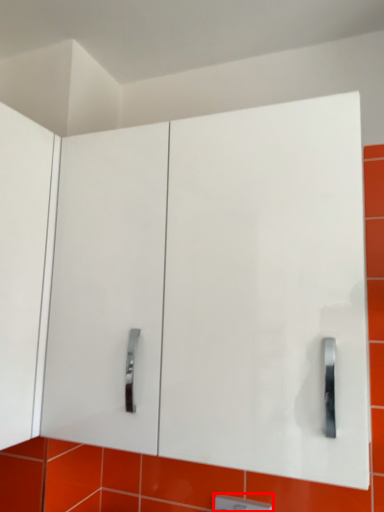
Question: From the image's perspective, considering the relative positions of light switch (annotated by the red box) and glass door in the image provided, where is light switch (annotated by the red box) located with respect to the staircase?

Choices:
 (A) above
 (B) below

Answer: (B)